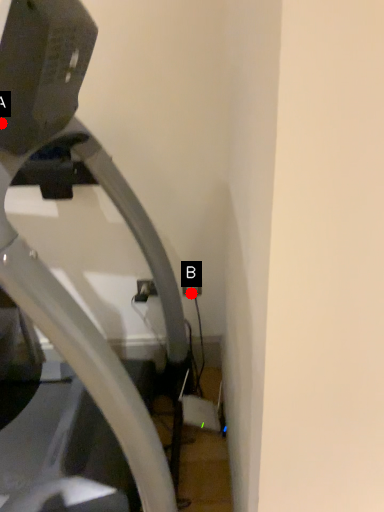
Question: Two points are circled on the image, labeled by A and B beside each circle. Which of the following is the closest to the observer?

Choices:
 (A) A is closer
 (B) B is closer

Answer: (A)